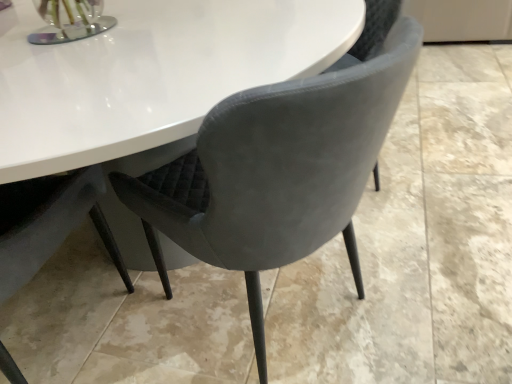
The image size is (512, 384). Identify the location of unoccupied region to the right of velvet grey chair at center. (433, 272).